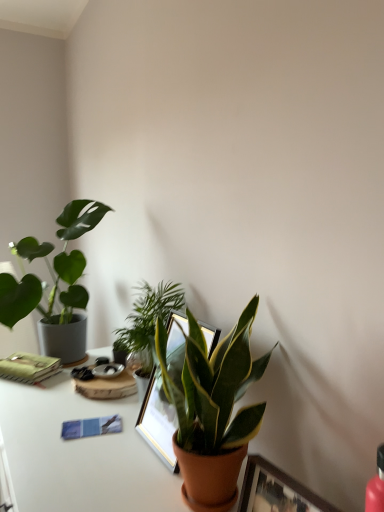
Find the location of a particular element. The image size is (384, 512). vacant area that is in front of green glossy plant at center, acting as the second houseplant starting from the right is located at coordinates (115, 442).